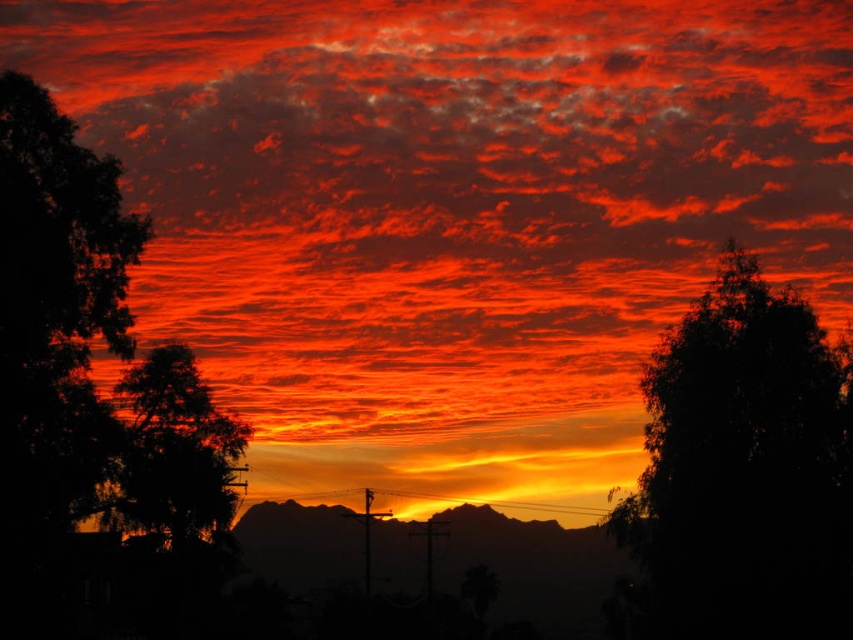
Is silky dark green tree at upper right smaller than silhouette tree at left?

Actually, silky dark green tree at upper right might be larger than silhouette tree at left.

Consider the image. Does silky dark green tree at upper right appear over silhouette tree at left?

Yes.

Find the location of `silky dark green tree at upper right`. silky dark green tree at upper right is located at coordinates (744, 470).